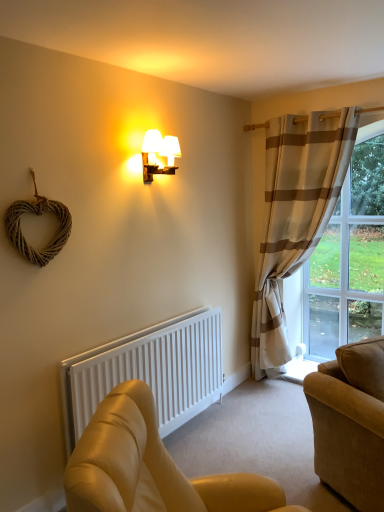
This screenshot has height=512, width=384. Identify the location of vacant space that's between beige striped curtain at right and white matte radiator at lower left. (247, 426).